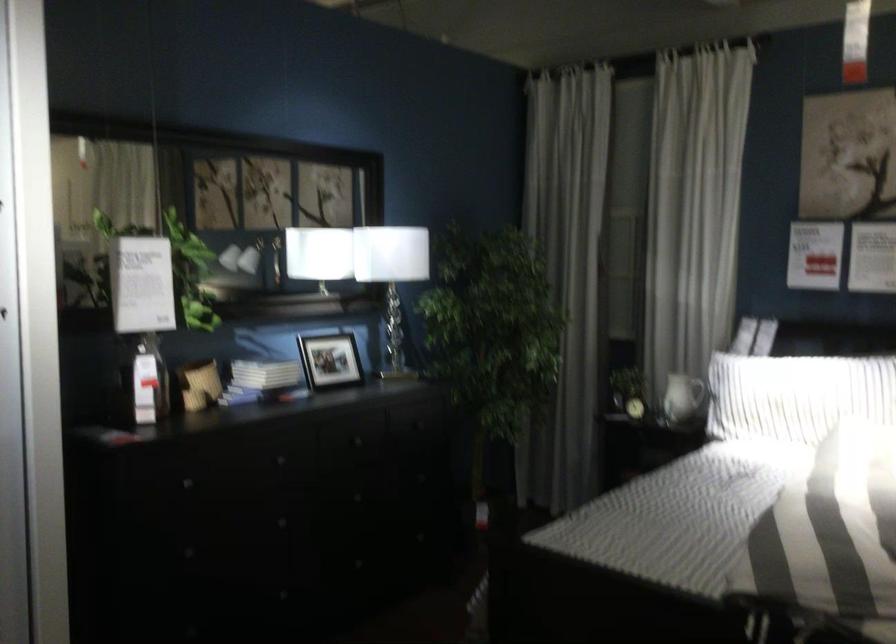
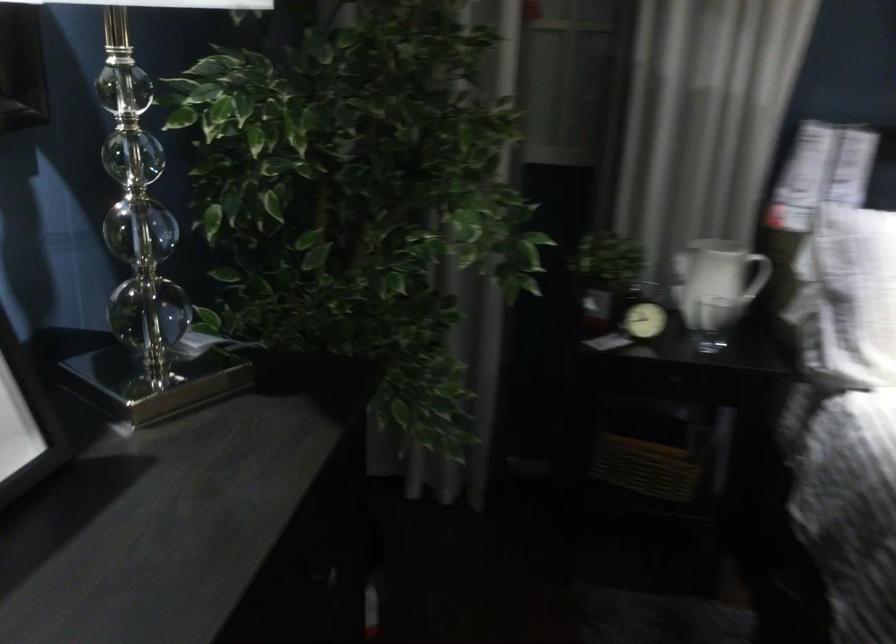
The point at (676, 402) is marked in the first image. Where is the corresponding point in the second image?

(713, 323)